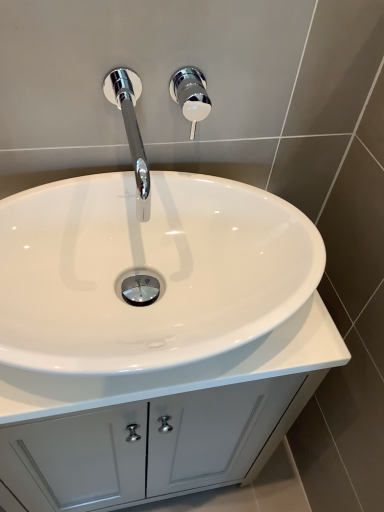
From the picture: Measure the distance between chrome/metallic faucet at upper center and camera.

chrome/metallic faucet at upper center is 25.20 inches from camera.

Describe the element at coordinates (131, 131) in the screenshot. I see `chrome/metallic faucet at upper center` at that location.

What are the coordinates of `white glossy sink at center` in the screenshot? It's located at click(147, 265).

Can you confirm if chrome/polished metal shower handle at upper center is shorter than chrome/metallic faucet at upper center?

In fact, chrome/polished metal shower handle at upper center may be taller than chrome/metallic faucet at upper center.

From the image's perspective, which object appears higher, chrome/polished metal shower handle at upper center or chrome/metallic faucet at upper center?

chrome/polished metal shower handle at upper center, from the image's perspective.

Could you tell me if chrome/polished metal shower handle at upper center is facing chrome/metallic faucet at upper center?

No, chrome/polished metal shower handle at upper center is not oriented towards chrome/metallic faucet at upper center.

How much distance is there between chrome/polished metal shower handle at upper center and chrome/metallic faucet at upper center?

chrome/polished metal shower handle at upper center is 3.78 inches from chrome/metallic faucet at upper center.

Measure the distance between chrome/metallic faucet at upper center and white glossy sink at center.

chrome/metallic faucet at upper center is 6.22 inches away from white glossy sink at center.

From a real-world perspective, is chrome/metallic faucet at upper center on white glossy sink at center?

Correct, in the physical world, chrome/metallic faucet at upper center is higher than white glossy sink at center.

Between chrome/metallic faucet at upper center and white glossy sink at center, which one has larger size?

Bigger between the two is white glossy sink at center.

Would you say chrome/polished metal shower handle at upper center is inside or outside white glossy sink at center?

chrome/polished metal shower handle at upper center is outside white glossy sink at center.

Between chrome/polished metal shower handle at upper center and white glossy sink at center, which one has smaller width?

Thinner between the two is chrome/polished metal shower handle at upper center.

Between chrome/polished metal shower handle at upper center and white glossy sink at center, which one has larger size?

white glossy sink at center is bigger.

From a real-world perspective, between white glossy sink at center and white glossy cabinet at center, who is vertically higher?

white glossy sink at center, from a real-world perspective.

Is white glossy sink at center inside the boundaries of white glossy cabinet at center, or outside?

white glossy sink at center is not inside white glossy cabinet at center, it's outside.

Is white glossy sink at center thinner than white glossy cabinet at center?

Indeed, white glossy sink at center has a lesser width compared to white glossy cabinet at center.

In the image, there is a white glossy cabinet at center. At what (x,y) coordinates should I click in order to perform the action: click on sink above it (from the image's perspective). Please return your answer as a coordinate pair (x, y). Looking at the image, I should click on (147, 265).

Can chrome/polished metal shower handle at upper center be found inside chrome/metallic faucet at upper center?

Actually, chrome/polished metal shower handle at upper center is outside chrome/metallic faucet at upper center.

Considering the sizes of objects chrome/metallic faucet at upper center and chrome/polished metal shower handle at upper center in the image provided, who is taller, chrome/metallic faucet at upper center or chrome/polished metal shower handle at upper center?

chrome/polished metal shower handle at upper center is taller.

Does chrome/metallic faucet at upper center lie behind chrome/polished metal shower handle at upper center?

No, the depth of chrome/metallic faucet at upper center is less than that of chrome/polished metal shower handle at upper center.

Consider the image. Can you confirm if chrome/metallic faucet at upper center is smaller than chrome/polished metal shower handle at upper center?

Incorrect, chrome/metallic faucet at upper center is not smaller in size than chrome/polished metal shower handle at upper center.

Does white glossy cabinet at center have a smaller size compared to white glossy sink at center?

Incorrect, white glossy cabinet at center is not smaller in size than white glossy sink at center.

Consider the image. From a real-world perspective, is white glossy cabinet at center below white glossy sink at center?

Yes, from a real-world perspective, white glossy cabinet at center is beneath white glossy sink at center.

From the image's perspective, is white glossy cabinet at center under white glossy sink at center?

Indeed, from the image's perspective, white glossy cabinet at center is shown beneath white glossy sink at center.

What's the angular difference between white glossy cabinet at center and chrome/polished metal shower handle at upper center's facing directions?

There is a 1.81-degree angle between the facing directions of white glossy cabinet at center and chrome/polished metal shower handle at upper center.

How far apart are white glossy cabinet at center and chrome/polished metal shower handle at upper center?

white glossy cabinet at center is 24.02 inches away from chrome/polished metal shower handle at upper center.

Where is `bathroom cabinet in front of the chrome/polished metal shower handle at upper center`? bathroom cabinet in front of the chrome/polished metal shower handle at upper center is located at coordinates (161, 421).

Is white glossy cabinet at center completely or partially outside of chrome/polished metal shower handle at upper center?

Yes, white glossy cabinet at center is not within chrome/polished metal shower handle at upper center.

The width and height of the screenshot is (384, 512). Find the location of `shower below the chrome/metallic faucet at upper center (from a real-world perspective)`. shower below the chrome/metallic faucet at upper center (from a real-world perspective) is located at coordinates (190, 95).

Locate an element on the screen. tap above the white glossy sink at center (from a real-world perspective) is located at coordinates (131, 131).

Which object lies further to the anchor point white glossy sink at center, chrome/polished metal shower handle at upper center or white glossy cabinet at center?

chrome/polished metal shower handle at upper center is positioned further to the anchor white glossy sink at center.

Looking at the image, which one is located closer to chrome/metallic faucet at upper center, white glossy sink at center or white glossy cabinet at center?

white glossy sink at center lies closer to chrome/metallic faucet at upper center than the other object.

Based on their spatial positions, is chrome/polished metal shower handle at upper center or white glossy sink at center closer to chrome/metallic faucet at upper center?

chrome/polished metal shower handle at upper center is positioned closer to the anchor chrome/metallic faucet at upper center.

From the image, which object appears to be nearer to chrome/polished metal shower handle at upper center, chrome/metallic faucet at upper center or white glossy cabinet at center?

chrome/metallic faucet at upper center lies closer to chrome/polished metal shower handle at upper center than the other object.

From the image, which object appears to be nearer to white glossy sink at center, chrome/metallic faucet at upper center or chrome/polished metal shower handle at upper center?

Among the two, chrome/metallic faucet at upper center is located nearer to white glossy sink at center.

Considering their positions, is white glossy cabinet at center positioned further to chrome/metallic faucet at upper center than chrome/polished metal shower handle at upper center?

white glossy cabinet at center is further to chrome/metallic faucet at upper center.

Estimate the real-world distances between objects in this image. Which object is closer to white glossy sink at center, chrome/polished metal shower handle at upper center or chrome/metallic faucet at upper center?

chrome/metallic faucet at upper center lies closer to white glossy sink at center than the other object.

When comparing their distances from chrome/polished metal shower handle at upper center, does white glossy sink at center or chrome/metallic faucet at upper center seem further?

white glossy sink at center.

I want to click on sink between chrome/polished metal shower handle at upper center and white glossy cabinet at center in the vertical direction, so click(147, 265).

What are the coordinates of `tap between chrome/polished metal shower handle at upper center and white glossy sink at center from top to bottom` in the screenshot? It's located at (131, 131).

Where is `sink between chrome/metallic faucet at upper center and white glossy cabinet at center from top to bottom`? The image size is (384, 512). sink between chrome/metallic faucet at upper center and white glossy cabinet at center from top to bottom is located at coordinates pos(147,265).

Find the location of a particular element. This screenshot has width=384, height=512. tap that lies between chrome/polished metal shower handle at upper center and white glossy cabinet at center from top to bottom is located at coordinates (131, 131).